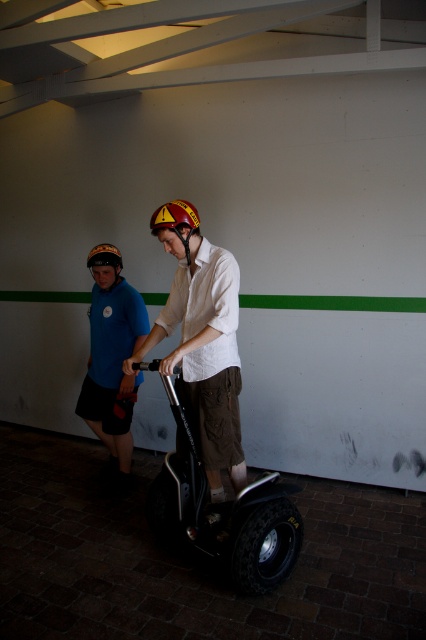
Between black rubber scooter at center and yellow/red reflective helmet at center, which one has more height?

black rubber scooter at center

Can you confirm if black rubber scooter at center is positioned below yellow/red reflective helmet at center?

Yes.

Is point (264, 540) farther from viewer compared to point (189, 237)?

That is False.

This screenshot has width=426, height=640. I want to click on black rubber scooter at center, so click(226, 516).

Which is behind, point (184, 497) or point (103, 253)?

Positioned behind is point (103, 253).

Between black rubber scooter at center and matte black helmet at upper center, which one has more height?

With more height is black rubber scooter at center.

Between point (209, 532) and point (103, 248), which one is positioned behind?

The point (103, 248) is more distant.

You are a GUI agent. You are given a task and a screenshot of the screen. Output one action in this format:
    pyautogui.click(x=<x>, y=<y>)
    Task: Click on the black rubber scooter at center
    
    Given the screenshot: What is the action you would take?
    pyautogui.click(x=226, y=516)

How much distance is there between matte white shirt at center and matte black helmet at upper center?

matte white shirt at center and matte black helmet at upper center are 37.07 inches apart from each other.

Can you confirm if matte white shirt at center is positioned to the right of matte black helmet at upper center?

Yes, matte white shirt at center is to the right of matte black helmet at upper center.

Between point (235, 285) and point (104, 252), which one is positioned behind?

Positioned behind is point (104, 252).

The height and width of the screenshot is (640, 426). I want to click on matte white shirt at center, so click(x=201, y=340).